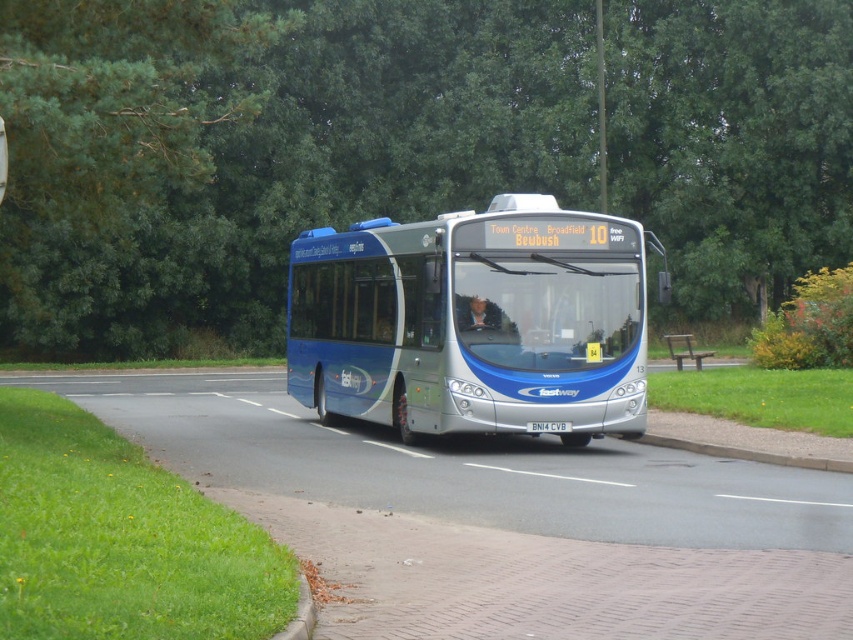
You are a passenger on the Eastway bus and want to know if the point at coordinate [838,148] is closer to you than the point at coordinate [399,272]. Can you determine this?

Point [838,148] is further to the camera than point [399,272], so the point at coordinate [399,272] is closer to you.

You are a passenger on the Eastway bus and you see a point marked at coordinates (259, 148). Based on the scene, where is this point located?

The point is located on a green leafy tree at upper center.

You are a delivery person who needs to place a package on top of the matte blue bus at center and the brown wooden bench at lower right. Which object can you place the package on without it falling off?

The matte blue bus at center has a greater height compared to the brown wooden bench at lower right, so the package can be placed on top of the matte blue bus at center without falling off.